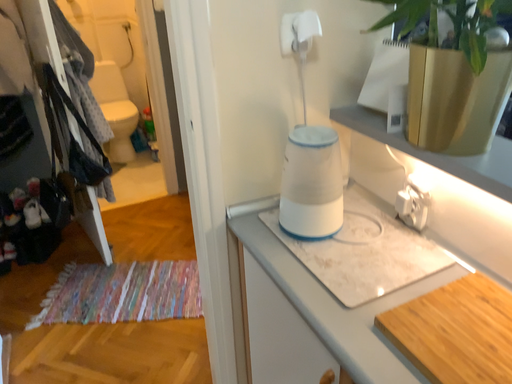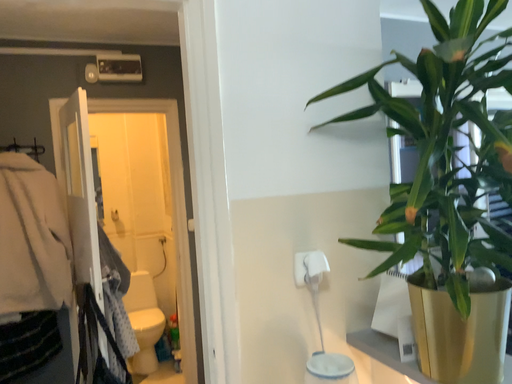
Question: How did the camera likely rotate when shooting the video?

Choices:
 (A) rotated downward
 (B) rotated upward

Answer: (B)